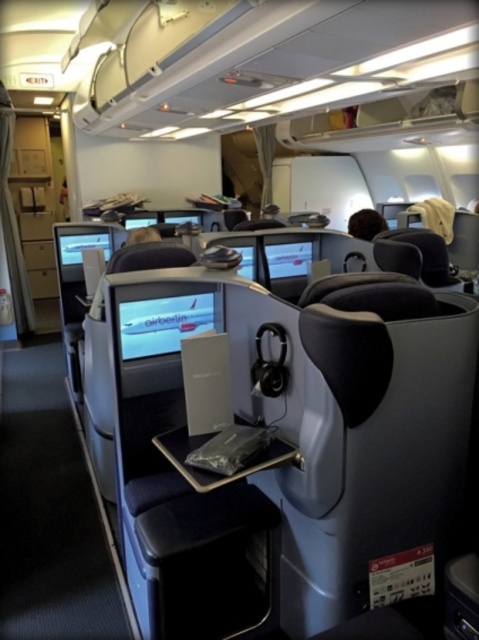
You are a flight attendant checking the inanimate objects in the airplane cabin. You see the white glossy airplane at center and the brown fuzzy object at upper center. Which object is narrower?

The white glossy airplane at center is narrower than the brown fuzzy object at upper center.

You are a passenger sitting in the business class section of an airplane. You notice the white glossy airplane at center and the brown fuzzy object at upper center. Which object is closer to you?

The white glossy airplane at center is closer to you because it is positioned in front of the brown fuzzy object at upper center.

You are a passenger sitting in the business class section of the airplane. You notice two items in your view ahead of you. One is the white glossy airplane at center and the other is the brown fuzzy object at upper center. Which of these two items is positioned higher up in your field of view?

The brown fuzzy object at upper center is positioned higher up in your field of view than the white glossy airplane at center.